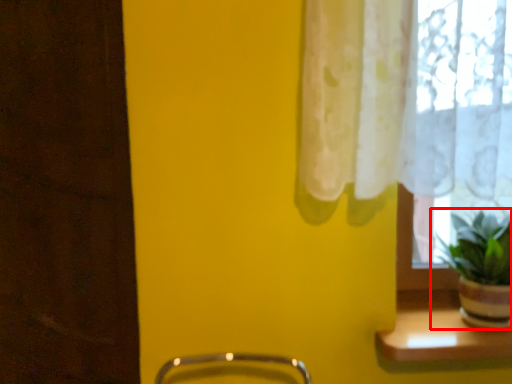
Question: From the image's perspective, considering the relative positions of houseplant (annotated by the red box) and window sill in the image provided, where is houseplant (annotated by the red box) located with respect to the staircase?

Choices:
 (A) above
 (B) below

Answer: (A)